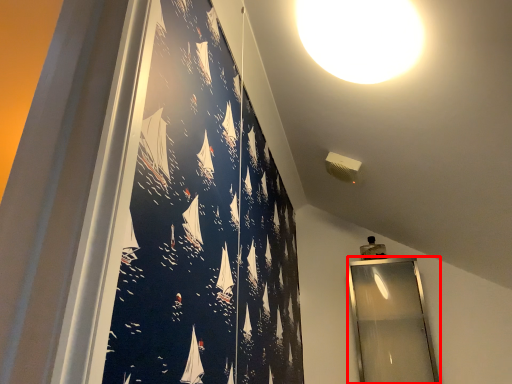
Question: From the image's perspective, what is the correct spatial relationship of mirror (annotated by the red box) in relation to lamp?

Choices:
 (A) above
 (B) below

Answer: (B)